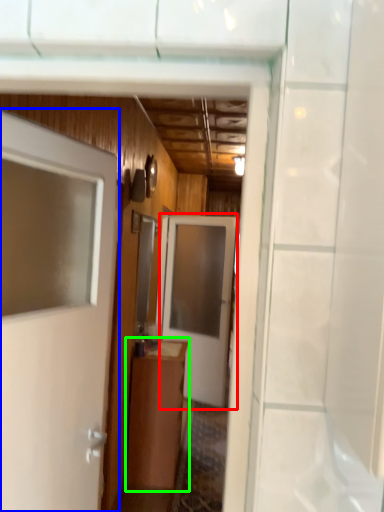
Question: Which is farther away from door (highlighted by a red box)? door (highlighted by a blue box) or cabinetry (highlighted by a green box)?

Choices:
 (A) door
 (B) cabinetry

Answer: (A)